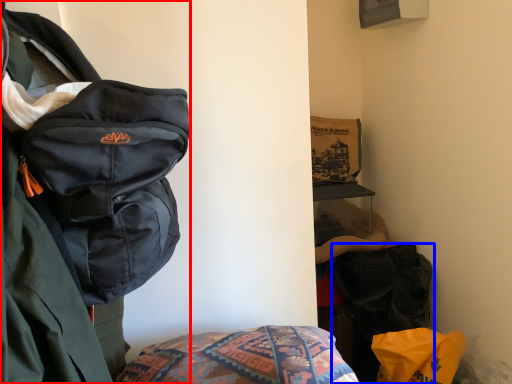
Question: Among these objects, which one is farthest to the camera, backpack (highlighted by a red box) or luggage and bags (highlighted by a blue box)?

Choices:
 (A) backpack
 (B) luggage and bags

Answer: (B)